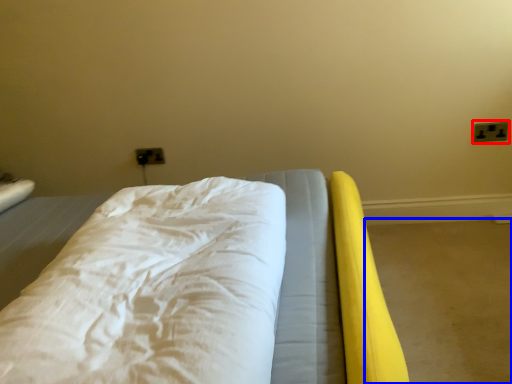
Question: Which of the following is the closest to the observer, electric outlet (highlighted by a red box) or concrete (highlighted by a blue box)?

Choices:
 (A) electric outlet
 (B) concrete

Answer: (B)